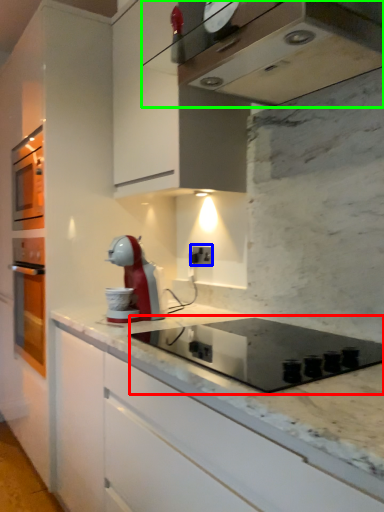
Question: Estimate the real-world distances between objects in this image. Which object is closer to appliance (highlighted by a red box), electric outlet (highlighted by a blue box) or home appliance (highlighted by a green box)?

Choices:
 (A) electric outlet
 (B) home appliance

Answer: (A)